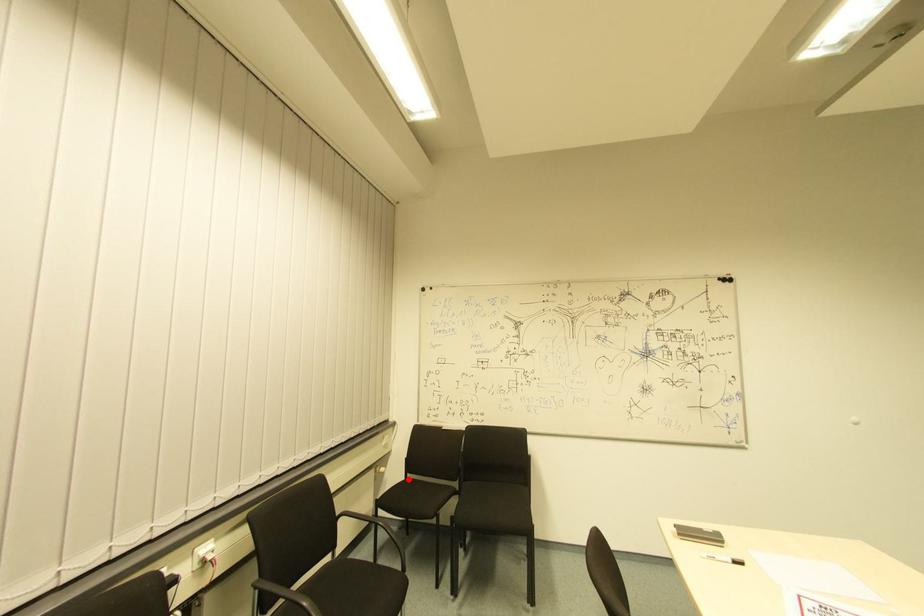
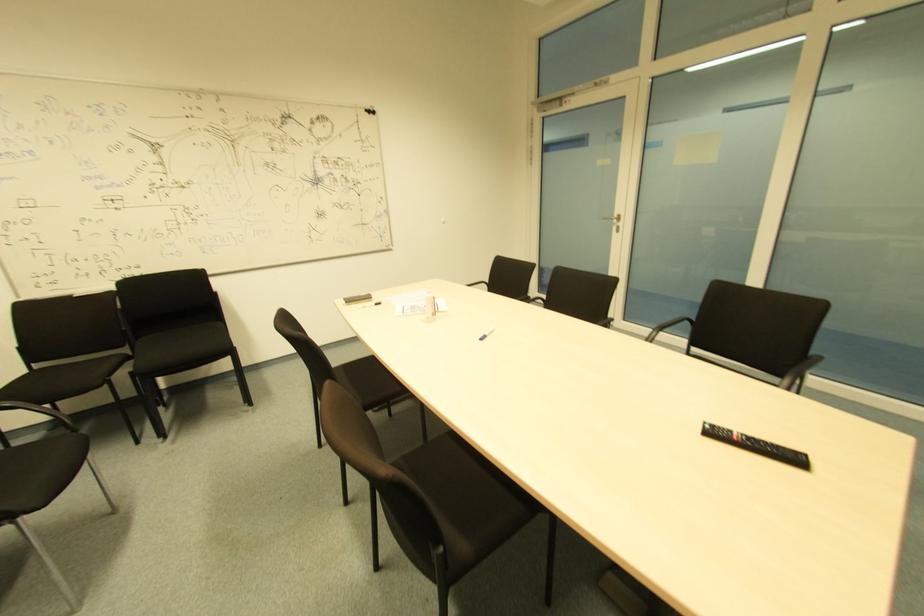
Question: I am providing you with two images of the same scene from different viewpoints. A red point is shown in image1. For the corresponding object point in image2, is it positioned nearer or farther from the camera?

Choices:
 (A) Nearer
 (B) Farther

Answer: (B)